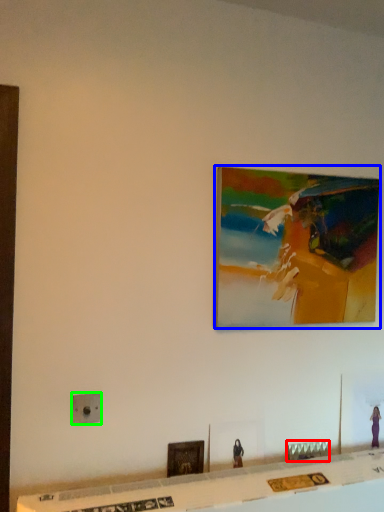
Question: Which is nearer to the furniture (highlighted by a red box)? picture frame (highlighted by a blue box) or electric outlet (highlighted by a green box).

Choices:
 (A) picture frame
 (B) electric outlet

Answer: (A)